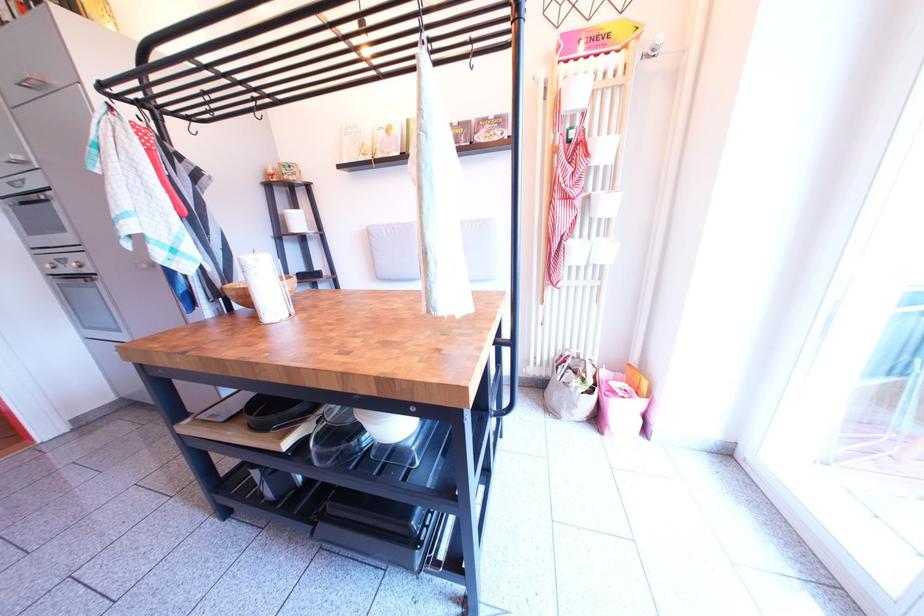
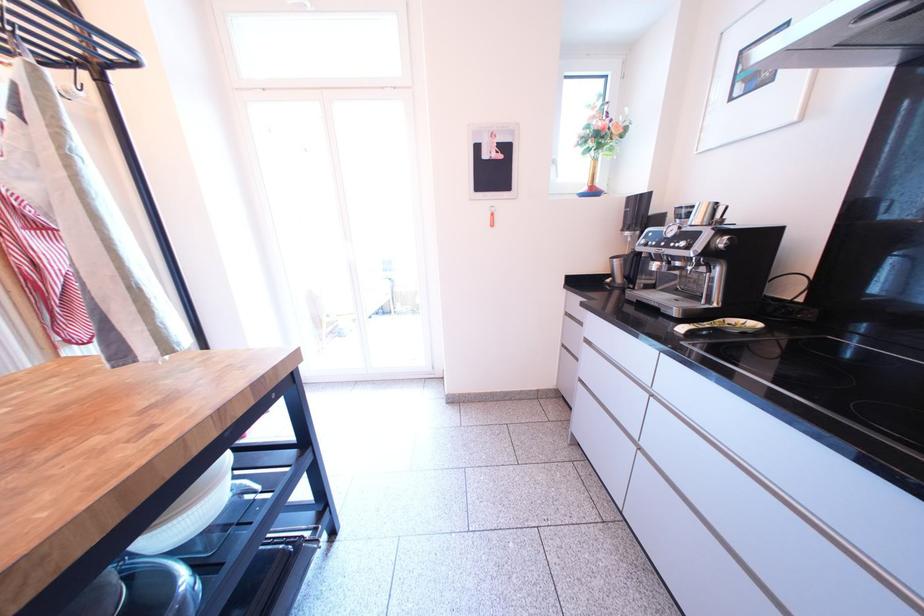
Based on the photo, the images are taken continuously from a first-person perspective. In which direction is your viewpoint rotating?

The camera's rotation is toward right-down.